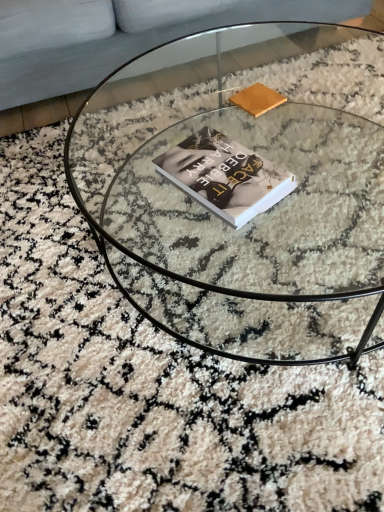
Question: Does hardcover book at center have a smaller size compared to matte brown book at upper center?

Choices:
 (A) yes
 (B) no

Answer: (B)

Question: Is the surface of hardcover book at center in direct contact with matte brown book at upper center?

Choices:
 (A) yes
 (B) no

Answer: (B)

Question: Does hardcover book at center come behind matte brown book at upper center?

Choices:
 (A) yes
 (B) no

Answer: (B)

Question: From the image's perspective, is hardcover book at center below matte brown book at upper center?

Choices:
 (A) no
 (B) yes

Answer: (B)

Question: From a real-world perspective, is hardcover book at center located beneath matte brown book at upper center?

Choices:
 (A) yes
 (B) no

Answer: (B)

Question: Is transparent glass coffee table at center to the left or to the right of light gray fabric couch at upper left in the image?

Choices:
 (A) left
 (B) right

Answer: (B)

Question: Considering the positions of point (314, 145) and point (367, 12), is point (314, 145) closer or farther from the camera than point (367, 12)?

Choices:
 (A) farther
 (B) closer

Answer: (B)

Question: Considering the positions of transparent glass coffee table at center and light gray fabric couch at upper left in the image, is transparent glass coffee table at center taller or shorter than light gray fabric couch at upper left?

Choices:
 (A) tall
 (B) short

Answer: (B)

Question: Looking at the image, does transparent glass coffee table at center seem bigger or smaller compared to light gray fabric couch at upper left?

Choices:
 (A) small
 (B) big

Answer: (A)

Question: Considering the positions of matte brown book at upper center and hardcover book at center in the image, is matte brown book at upper center wider or thinner than hardcover book at center?

Choices:
 (A) wide
 (B) thin

Answer: (B)

Question: Is matte brown book at upper center to the left or to the right of hardcover book at center in the image?

Choices:
 (A) left
 (B) right

Answer: (B)

Question: From a real-world perspective, is matte brown book at upper center positioned above or below hardcover book at center?

Choices:
 (A) above
 (B) below

Answer: (B)

Question: Relative to hardcover book at center, is matte brown book at upper center in front or behind?

Choices:
 (A) behind
 (B) front

Answer: (A)

Question: In terms of height, does light gray fabric couch at upper left look taller or shorter compared to hardcover book at center?

Choices:
 (A) short
 (B) tall

Answer: (B)

Question: Is light gray fabric couch at upper left to the left or to the right of hardcover book at center in the image?

Choices:
 (A) left
 (B) right

Answer: (A)